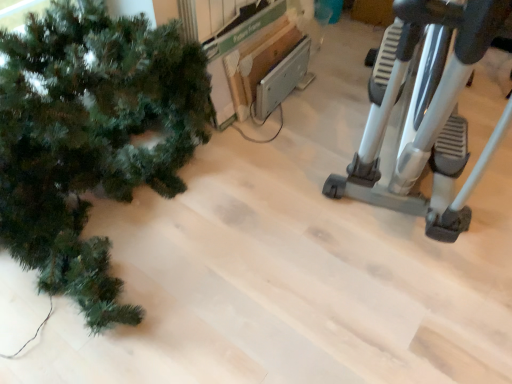
The width and height of the screenshot is (512, 384). In order to click on silver metallic stationary bicycle at right in this screenshot , I will do `click(426, 113)`.

This screenshot has width=512, height=384. Describe the element at coordinates (426, 113) in the screenshot. I see `silver metallic stationary bicycle at right` at that location.

Measure the distance between green matte christmas tree at left and camera.

green matte christmas tree at left and camera are 3.91 feet apart from each other.

The image size is (512, 384). What do you see at coordinates (90, 138) in the screenshot?
I see `green matte christmas tree at left` at bounding box center [90, 138].

You are a GUI agent. You are given a task and a screenshot of the screen. Output one action in this format:
    pyautogui.click(x=<x>, y=<y>)
    Task: Click on the green matte christmas tree at left
    
    Given the screenshot: What is the action you would take?
    pyautogui.click(x=90, y=138)

Find the location of `silver metallic stationary bicycle at right`. silver metallic stationary bicycle at right is located at coordinates (426, 113).

Which object is positioned more to the right, silver metallic stationary bicycle at right or green matte christmas tree at left?

From the viewer's perspective, silver metallic stationary bicycle at right appears more on the right side.

Which object is further away from the camera taking this photo, silver metallic stationary bicycle at right or green matte christmas tree at left?

Positioned behind is green matte christmas tree at left.

Is point (377, 125) positioned behind point (55, 207)?

No, it is not.

From the image's perspective, is silver metallic stationary bicycle at right located above green matte christmas tree at left?

Yes, from the image's perspective, silver metallic stationary bicycle at right is over green matte christmas tree at left.

From the picture: From a real-world perspective, is silver metallic stationary bicycle at right over green matte christmas tree at left?

Yes.

Considering the sizes of objects silver metallic stationary bicycle at right and green matte christmas tree at left in the image provided, who is thinner, silver metallic stationary bicycle at right or green matte christmas tree at left?

green matte christmas tree at left.

Who is taller, silver metallic stationary bicycle at right or green matte christmas tree at left?

silver metallic stationary bicycle at right.

Looking at the image, does silver metallic stationary bicycle at right seem bigger or smaller compared to green matte christmas tree at left?

Clearly, silver metallic stationary bicycle at right is larger in size than green matte christmas tree at left.

Choose the correct answer: Is silver metallic stationary bicycle at right inside green matte christmas tree at left or outside it?

silver metallic stationary bicycle at right is not enclosed by green matte christmas tree at left.

Is silver metallic stationary bicycle at right next to green matte christmas tree at left and touching it?

silver metallic stationary bicycle at right and green matte christmas tree at left are not in contact.

Is silver metallic stationary bicycle at right aimed at green matte christmas tree at left?

No, silver metallic stationary bicycle at right is not facing towards green matte christmas tree at left.

How many degrees apart are the facing directions of silver metallic stationary bicycle at right and green matte christmas tree at left?

The angle between the facing direction of silver metallic stationary bicycle at right and the facing direction of green matte christmas tree at left is 71.9 degrees.

Locate an element on the screen. This screenshot has width=512, height=384. stationary bicycle above the green matte christmas tree at left (from the image's perspective) is located at coordinates (426, 113).

Considering the relative positions of green matte christmas tree at left and silver metallic stationary bicycle at right in the image provided, is green matte christmas tree at left to the left of silver metallic stationary bicycle at right from the viewer's perspective?

Correct, you'll find green matte christmas tree at left to the left of silver metallic stationary bicycle at right.

Which is behind, green matte christmas tree at left or silver metallic stationary bicycle at right?

green matte christmas tree at left is more distant.

Is point (59, 15) closer or farther from the camera than point (432, 115)?

Point (59, 15).

From the image's perspective, is green matte christmas tree at left on top of silver metallic stationary bicycle at right?

Incorrect, from the image's perspective, green matte christmas tree at left is lower than silver metallic stationary bicycle at right.

From a real-world perspective, between green matte christmas tree at left and silver metallic stationary bicycle at right, who is vertically higher?

From a 3D spatial view, silver metallic stationary bicycle at right is above.

Considering the sizes of objects green matte christmas tree at left and silver metallic stationary bicycle at right in the image provided, who is thinner, green matte christmas tree at left or silver metallic stationary bicycle at right?

Thinner between the two is green matte christmas tree at left.

From the picture: From their relative heights in the image, would you say green matte christmas tree at left is taller or shorter than silver metallic stationary bicycle at right?

In the image, green matte christmas tree at left appears to be shorter than silver metallic stationary bicycle at right.

Which of these two, green matte christmas tree at left or silver metallic stationary bicycle at right, is smaller?

green matte christmas tree at left.

Is green matte christmas tree at left completely or partially outside of silver metallic stationary bicycle at right?

Yes, green matte christmas tree at left is located beyond the bounds of silver metallic stationary bicycle at right.

From the picture: Does green matte christmas tree at left touch silver metallic stationary bicycle at right?

green matte christmas tree at left is not next to silver metallic stationary bicycle at right, and they're not touching.

Is green matte christmas tree at left oriented away from silver metallic stationary bicycle at right?

green matte christmas tree at left does not have its back to silver metallic stationary bicycle at right.

How many degrees apart are the facing directions of green matte christmas tree at left and silver metallic stationary bicycle at right?

green matte christmas tree at left and silver metallic stationary bicycle at right are facing 71.9 degrees away from each other.

The height and width of the screenshot is (384, 512). I want to click on stationary bicycle above the green matte christmas tree at left (from the image's perspective), so click(x=426, y=113).

Image resolution: width=512 pixels, height=384 pixels. I want to click on stationary bicycle that is above the green matte christmas tree at left (from a real-world perspective), so click(x=426, y=113).

Locate an element on the screen. stationary bicycle above the green matte christmas tree at left (from the image's perspective) is located at coordinates (426, 113).